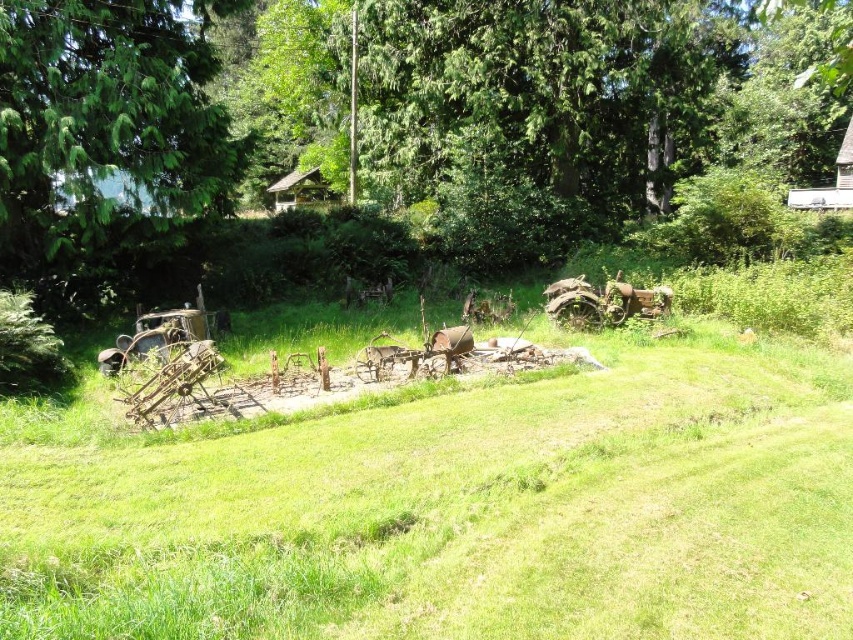
You are standing on the green lawn in the foreground of the image. You want to take a photo of the wooden hut at upper right but notice the green textured tree at left might block your view. Based on their heights, can you determine if the tree will block the view of the hut?

The green textured tree at left has a lesser height compared to wooden hut at upper right, so the tree will not block the view of the wooden hut at upper right because the hut is taller.

You are standing at the edge of the grassy area and want to take a photo of the green leafy tree at center. If your camera has a maximum focus range of 7 meters, will it be able to capture the tree clearly?

The green leafy tree at center is 7.02 meters away from the camera. Since the camera can focus up to 7 meters, it cannot capture the tree clearly as the distance exceeds its maximum focus range.

Based on the photo, you are planning to set up a temporary campsite and need to choose between the wooden hut at upper right and the wooden hut at center. Based on the spatial details provided, which wooden hut would be more suitable for accommodating a larger group of people?

The wooden hut at upper right might be wider than the wooden hut at center, so it would be more suitable for accommodating a larger group of people.